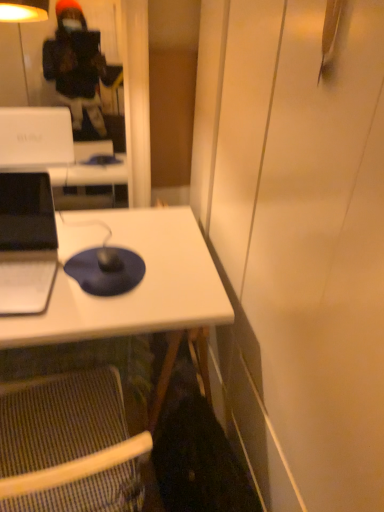
I want to click on vacant location behind blue matte mousepad at center, so click(115, 231).